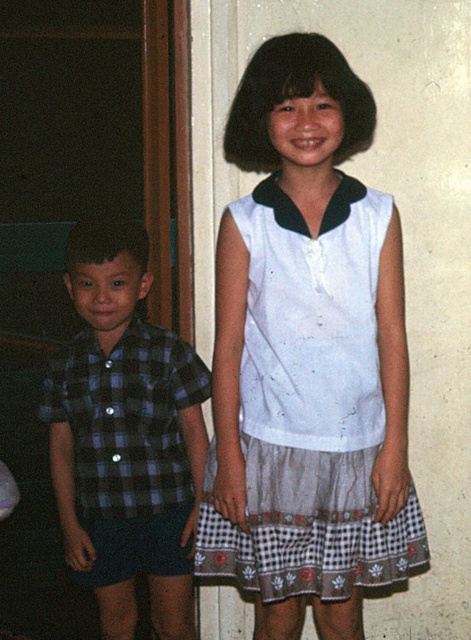
Can you confirm if white cotton dress at upper center is thinner than checkered fabric shirt at left?

In fact, white cotton dress at upper center might be wider than checkered fabric shirt at left.

Image resolution: width=471 pixels, height=640 pixels. Describe the element at coordinates (309, 406) in the screenshot. I see `white cotton dress at upper center` at that location.

Find the location of a particular element. This screenshot has width=471, height=640. white cotton dress at upper center is located at coordinates (309, 406).

How much distance is there between checkered fabric shirt at left and plaid fabric shirt at left?

The distance of checkered fabric shirt at left from plaid fabric shirt at left is 2.18 inches.

Between checkered fabric shirt at left and plaid fabric shirt at left, which one is positioned lower?

Positioned lower is checkered fabric shirt at left.

At what (x,y) coordinates should I click in order to perform the action: click on checkered fabric shirt at left. Please return your answer as a coordinate pair (x, y). Image resolution: width=471 pixels, height=640 pixels. Looking at the image, I should click on (126, 436).

Is point (398, 566) positioned behind point (70, 392)?

That is False.

Who is positioned more to the left, white cotton dress at upper center or plaid fabric shirt at left?

Positioned to the left is plaid fabric shirt at left.

At what (x,y) coordinates should I click in order to perform the action: click on white cotton dress at upper center. Please return your answer as a coordinate pair (x, y). This screenshot has width=471, height=640. Looking at the image, I should click on (309, 406).

Where is `white cotton dress at upper center`? Image resolution: width=471 pixels, height=640 pixels. white cotton dress at upper center is located at coordinates tap(309, 406).